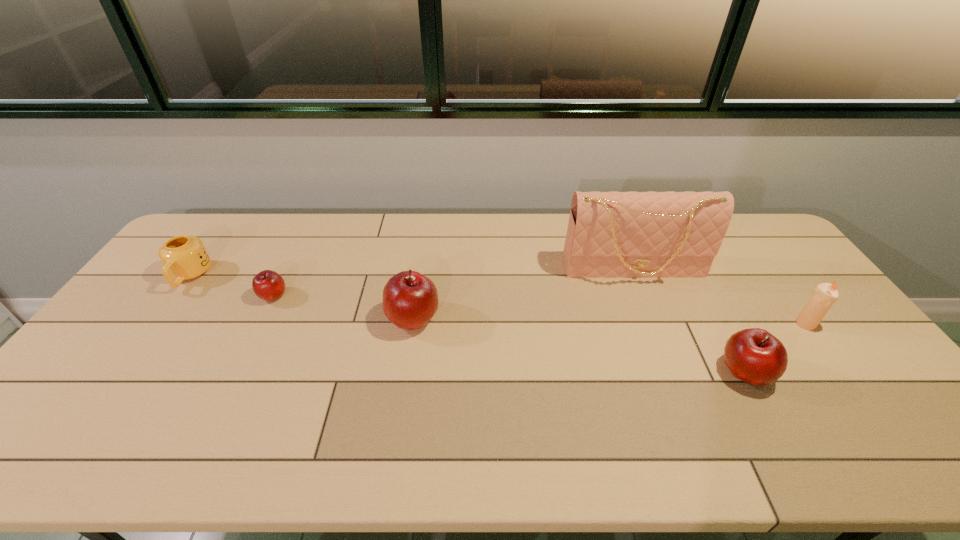
Locate an element on the screen. This screenshot has height=540, width=960. the fifth closest object to the nearest apple is located at coordinates click(184, 257).

Identify the location of object that is the third closest to the rightmost apple. coord(410,299).

Locate an element on the screen. The height and width of the screenshot is (540, 960). apple that stands as the second closest to the candle is located at coordinates (410, 299).

Locate an element on the screen. apple that can be found as the second closest to the shortest object is located at coordinates (755, 356).

At what (x,y) coordinates should I click in order to perform the action: click on vacant space that satisfies the following two spatial constraints: 1. on the front-facing side of the tallest object; 2. on the left side of the rightmost apple. Please return your answer as a coordinate pair (x, y). Looking at the image, I should click on (674, 372).